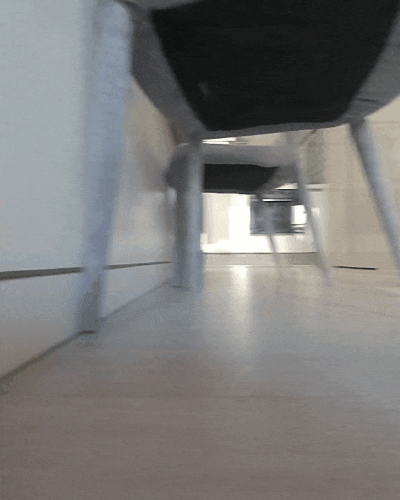
Find the location of a particular element. wall is located at coordinates (58, 168), (380, 197).